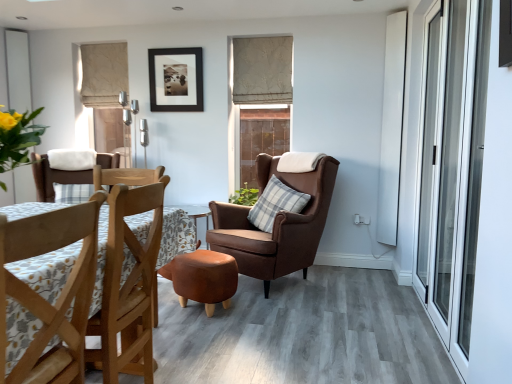
This screenshot has height=384, width=512. What do you see at coordinates (103, 74) in the screenshot?
I see `beige fabric curtain at upper left, which is counted as the second curtain, starting from the right` at bounding box center [103, 74].

Describe the element at coordinates (262, 70) in the screenshot. The image size is (512, 384). I see `beige textured curtain at upper center, the second curtain viewed from the left` at that location.

Find the location of `black matte picture frame at upper center`. black matte picture frame at upper center is located at coordinates (176, 79).

Image resolution: width=512 pixels, height=384 pixels. What do you see at coordinates (54, 177) in the screenshot? I see `wooden chair at center, which is counted as the 3th chair, starting from the right` at bounding box center [54, 177].

What is the approximate width of wooden chair at lower left, placed as the 2th chair when sorted from right to left?

wooden chair at lower left, placed as the 2th chair when sorted from right to left, is 44.98 centimeters wide.

Locate an element on the screen. beige fabric curtain at upper left, which is counted as the second curtain, starting from the right is located at coordinates (103, 74).

Does transparent glass screen door at right come behind beige fabric curtain at upper left, the first curtain positioned from the left?

No, transparent glass screen door at right is closer to the camera.

Considering the relative positions of transparent glass screen door at right and beige fabric curtain at upper left, which is counted as the second curtain, starting from the right, in the image provided, is transparent glass screen door at right to the left of beige fabric curtain at upper left, which is counted as the second curtain, starting from the right, from the viewer's perspective?

No.

From the image's perspective, which is above, transparent glass screen door at right or beige fabric curtain at upper left, which is counted as the second curtain, starting from the right?

beige fabric curtain at upper left, which is counted as the second curtain, starting from the right, appears higher in the image.

Can you confirm if transparent glass screen door at right is shorter than beige fabric curtain at upper left, the first curtain positioned from the left?

Incorrect, the height of transparent glass screen door at right does not fall short of that of beige fabric curtain at upper left, the first curtain positioned from the left.

This screenshot has width=512, height=384. There is a leather ottoman at center. Find the location of `the 1st chair above it (from the image's perspective)`. the 1st chair above it (from the image's perspective) is located at coordinates (42, 298).

Considering the relative sizes of leather ottoman at center and wooden chair at lower left, placed as the 2th chair when sorted from right to left, in the image provided, is leather ottoman at center shorter than wooden chair at lower left, placed as the 2th chair when sorted from right to left,?

Correct, leather ottoman at center is not as tall as wooden chair at lower left, placed as the 2th chair when sorted from right to left.

In the scene shown: Are leather ottoman at center and wooden chair at lower left, the 1th chair positioned from the front, located far from each other?

leather ottoman at center is positioned a significant distance from wooden chair at lower left, the 1th chair positioned from the front.

From the image's perspective, is leather ottoman at center above or below wooden chair at lower left, which is counted as the second chair, starting from the left?

leather ottoman at center is below wooden chair at lower left, which is counted as the second chair, starting from the left.

Based on the photo, considering the sizes of brown leather armchair at center, placed as the 2th chair when sorted from front to back, and white matte window at upper left, the 1th window from the left, in the image, is brown leather armchair at center, placed as the 2th chair when sorted from front to back, bigger or smaller than white matte window at upper left, the 1th window from the left,?

brown leather armchair at center, placed as the 2th chair when sorted from front to back, is bigger than white matte window at upper left, the 1th window from the left.

Is brown leather armchair at center, placed as the 2th chair when sorted from front to back, not near white matte window at upper left, the second window when ordered from right to left?

Yes.

Can you tell me how much brown leather armchair at center, the 2th chair from the back, and white matte window at upper left, the 1th window from the left, differ in facing direction?

The angular difference between brown leather armchair at center, the 2th chair from the back, and white matte window at upper left, the 1th window from the left, is 78.2 degrees.

How distant is brown leather armchair at center, acting as the third chair starting from the left, from white matte window at upper left, the 1th window from the left?

They are 2.72 meters apart.

Is white matte window at upper left, the 1th window from the left, shorter than wooden chair at lower left, placed as the 2th chair when sorted from right to left?

No, white matte window at upper left, the 1th window from the left, is not shorter than wooden chair at lower left, placed as the 2th chair when sorted from right to left.

From a real-world perspective, which object rests below the other?

wooden chair at lower left, which ranks as the 3th chair in back-to-front order, from a real-world perspective.

Between point (25, 176) and point (4, 350), which one is positioned in front?

The point (4, 350) is closer to the camera.

Looking at the image, does white matte window at upper left, the second window when ordered from right to left, seem bigger or smaller compared to wooden chair at lower left, which is counted as the second chair, starting from the left?

Clearly, white matte window at upper left, the second window when ordered from right to left, is smaller in size than wooden chair at lower left, which is counted as the second chair, starting from the left.

Considering the positions of points (247, 50) and (191, 88), is point (247, 50) farther from camera compared to point (191, 88)?

No.

From a real-world perspective, is beige textured curtain at upper center, the second curtain viewed from the left, beneath black matte picture frame at upper center?

No, from a real-world perspective, beige textured curtain at upper center, the second curtain viewed from the left, is not beneath black matte picture frame at upper center.

Can you confirm if beige textured curtain at upper center, the second curtain viewed from the left, is wider than black matte picture frame at upper center?

Indeed, beige textured curtain at upper center, the second curtain viewed from the left, has a greater width compared to black matte picture frame at upper center.

Are beige textured curtain at upper center, the 1th curtain when ordered from right to left, and black matte picture frame at upper center located far from each other?

Actually, beige textured curtain at upper center, the 1th curtain when ordered from right to left, and black matte picture frame at upper center are a little close together.

Where is `picture frame on the left side of plaid fabric pillow at center`? picture frame on the left side of plaid fabric pillow at center is located at coordinates (176, 79).

Is plaid fabric pillow at center surrounding black matte picture frame at upper center?

No, black matte picture frame at upper center is not surrounded by plaid fabric pillow at center.

From the picture: Is plaid fabric pillow at center facing away from black matte picture frame at upper center?

plaid fabric pillow at center is not turned away from black matte picture frame at upper center.

From the image's perspective, would you say plaid fabric pillow at center is shown under black matte picture frame at upper center?

Yes, from the image's perspective, plaid fabric pillow at center is beneath black matte picture frame at upper center.

Is brown wooden chair at center, which is the 1th window from right to left, oriented away from black matte picture frame at upper center?

brown wooden chair at center, which is the 1th window from right to left, does not have its back to black matte picture frame at upper center.

Is brown wooden chair at center, which is the 1th window from right to left, far from black matte picture frame at upper center?

Actually, brown wooden chair at center, which is the 1th window from right to left, and black matte picture frame at upper center are a little close together.

Considering the relative positions of brown wooden chair at center, arranged as the 2th window when viewed from the left, and black matte picture frame at upper center in the image provided, is brown wooden chair at center, arranged as the 2th window when viewed from the left, to the right of black matte picture frame at upper center from the viewer's perspective?

Correct, you'll find brown wooden chair at center, arranged as the 2th window when viewed from the left, to the right of black matte picture frame at upper center.

Is brown wooden chair at center, arranged as the 2th window when viewed from the left, completely or partially outside of black matte picture frame at upper center?

Indeed, brown wooden chair at center, arranged as the 2th window when viewed from the left, is completely outside black matte picture frame at upper center.

Locate an element on the screen. The image size is (512, 384). screen door located on the right of beige fabric curtain at upper left, which is counted as the second curtain, starting from the right is located at coordinates (452, 166).

Find the location of a particular element. The width and height of the screenshot is (512, 384). chair in front of the leather ottoman at center is located at coordinates (42, 298).

Estimate the real-world distances between objects in this image. Which object is further from white matte window at upper left, the 1th window from the left, wooden chair at lower left, which is counted as the second chair, starting from the left, or brown wooden chair at center, arranged as the 2th window when viewed from the left?

wooden chair at lower left, which is counted as the second chair, starting from the left, is further to white matte window at upper left, the 1th window from the left.

Considering their positions, is green leafy plant at center positioned closer to beige fabric curtain at upper left, the first curtain positioned from the left, than transparent glass screen door at right?

green leafy plant at center lies closer to beige fabric curtain at upper left, the first curtain positioned from the left, than the other object.

Based on their spatial positions, is white matte window at upper left, the second window when ordered from right to left, or plaid fabric pillow at center closer to leather ottoman at center?

Based on the image, plaid fabric pillow at center appears to be nearer to leather ottoman at center.

Considering their positions, is green leafy plant at center positioned further to brown leather armchair at center, acting as the third chair starting from the left, than beige fabric curtain at upper left, which is counted as the second curtain, starting from the right?

beige fabric curtain at upper left, which is counted as the second curtain, starting from the right, is further to brown leather armchair at center, acting as the third chair starting from the left.

Looking at this image, based on their spatial positions, is transparent glass screen door at right or brown wooden chair at center, arranged as the 2th window when viewed from the left, closer to leather ottoman at center?

transparent glass screen door at right lies closer to leather ottoman at center than the other object.

From the image, which object appears to be nearer to green leafy plant at center, leather ottoman at center or transparent glass screen door at right?

leather ottoman at center.

Considering their positions, is beige textured curtain at upper center, the second curtain viewed from the left, positioned closer to wooden chair at center, marked as the 3th chair in a front-to-back arrangement, than green leafy plant at center?

The object closer to wooden chair at center, marked as the 3th chair in a front-to-back arrangement, is green leafy plant at center.

Looking at the image, which one is located closer to green leafy plant at center, leather ottoman at center or plaid fabric pillow at center?

Among the two, plaid fabric pillow at center is located nearer to green leafy plant at center.

At what (x,y) coordinates should I click in order to perform the action: click on picture frame between wooden chair at lower left, placed as the 2th chair when sorted from right to left, and white matte window at upper left, the 1th window from the left, along the z-axis. Please return your answer as a coordinate pair (x, y). The width and height of the screenshot is (512, 384). Looking at the image, I should click on (176, 79).

The image size is (512, 384). What are the coordinates of `houseplant between brown leather armchair at center, placed as the 2th chair when sorted from front to back, and brown wooden chair at center, arranged as the 2th window when viewed from the left, along the z-axis` in the screenshot? It's located at (245, 196).

Locate an element on the screen. chair positioned between leather ottoman at center and plaid fabric pillow at center from near to far is located at coordinates (276, 224).

Where is `curtain between beige fabric curtain at upper left, which is counted as the second curtain, starting from the right, and transparent glass screen door at right, in the horizontal direction`? This screenshot has width=512, height=384. curtain between beige fabric curtain at upper left, which is counted as the second curtain, starting from the right, and transparent glass screen door at right, in the horizontal direction is located at coordinates (262, 70).